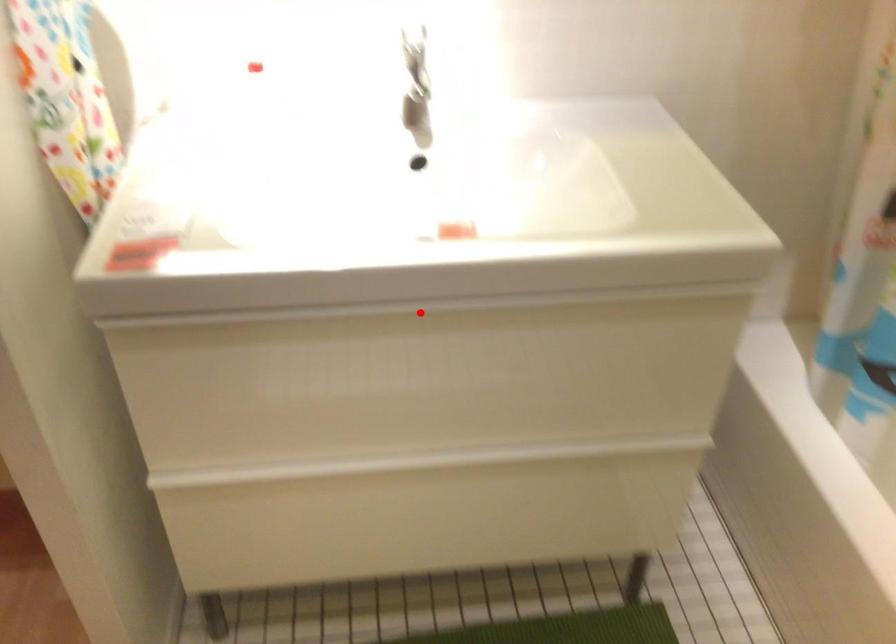
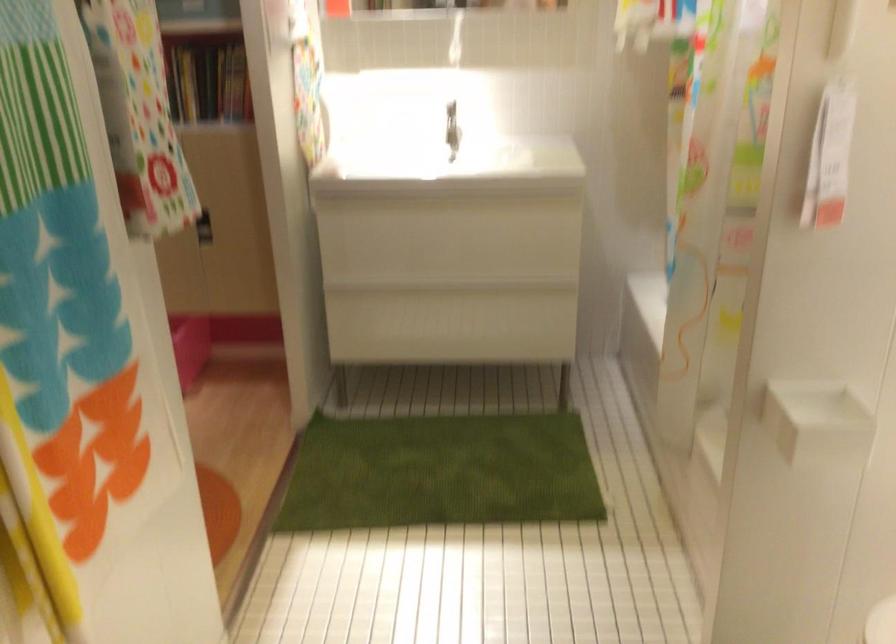
In the second image, find the point that corresponds to the highlighted location in the first image.

(440, 201)